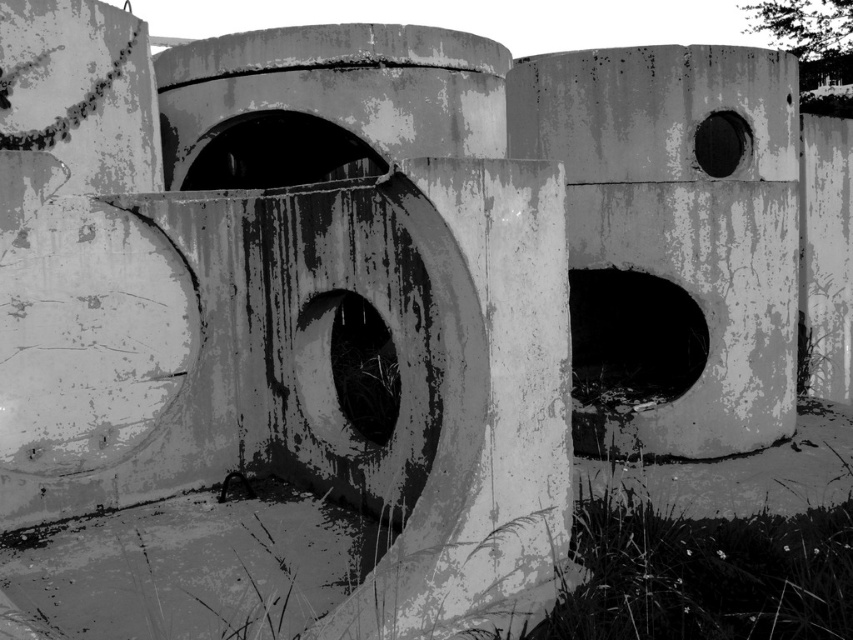
Question: Considering the relative positions of rusty concrete pillar at center and concrete wall at center in the image provided, where is rusty concrete pillar at center located with respect to concrete wall at center?

Choices:
 (A) right
 (B) left

Answer: (B)

Question: Which of the following is the farthest from the observer?

Choices:
 (A) (769, 417)
 (B) (194, 99)

Answer: (B)

Question: Is rusty concrete pillar at center further to camera compared to concrete wall at center?

Choices:
 (A) yes
 (B) no

Answer: (B)

Question: Does rusty concrete pillar at center have a smaller size compared to concrete wall at center?

Choices:
 (A) yes
 (B) no

Answer: (A)

Question: Which point is closer to the camera?

Choices:
 (A) concrete wall at center
 (B) rusty concrete pillar at center

Answer: (B)

Question: Which point is farther from the camera taking this photo?

Choices:
 (A) (683, 136)
 (B) (355, 74)

Answer: (B)